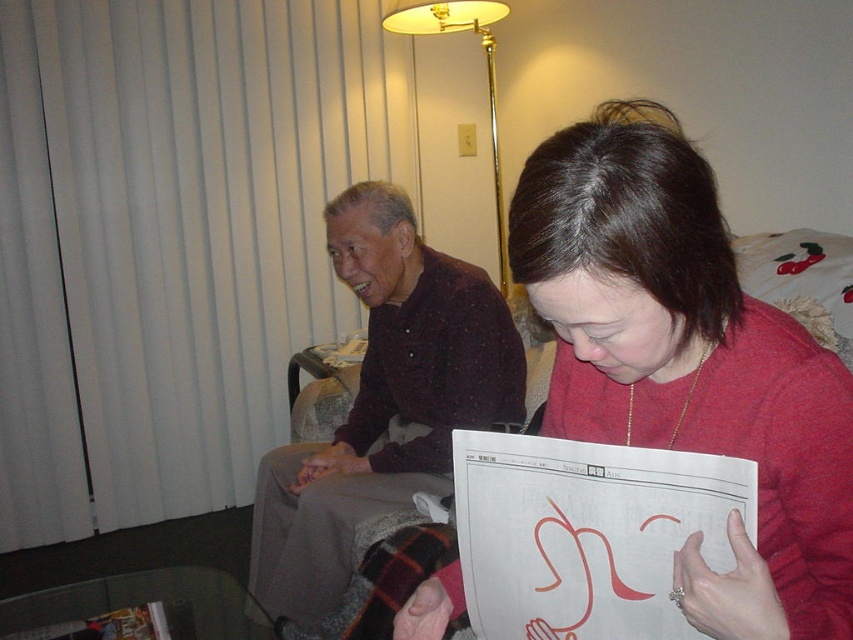
Question: Can you confirm if matte red sweater at center is thinner than gold metallic floor lamp at upper center?

Choices:
 (A) no
 (B) yes

Answer: (A)

Question: Is dark brown sweater at center thinner than gold metallic floor lamp at upper center?

Choices:
 (A) yes
 (B) no

Answer: (B)

Question: Which is nearer to the matte red sweater at center?

Choices:
 (A) gold metallic floor lamp at upper center
 (B) dark brown sweater at center

Answer: (B)

Question: Is matte red sweater at center below dark brown sweater at center?

Choices:
 (A) yes
 (B) no

Answer: (B)

Question: Which is nearer to the matte red sweater at center?

Choices:
 (A) gold metallic floor lamp at upper center
 (B) dark brown sweater at center

Answer: (B)

Question: Which object is positioned closest to the matte red sweater at center?

Choices:
 (A) gold metallic floor lamp at upper center
 (B) dark brown sweater at center

Answer: (B)